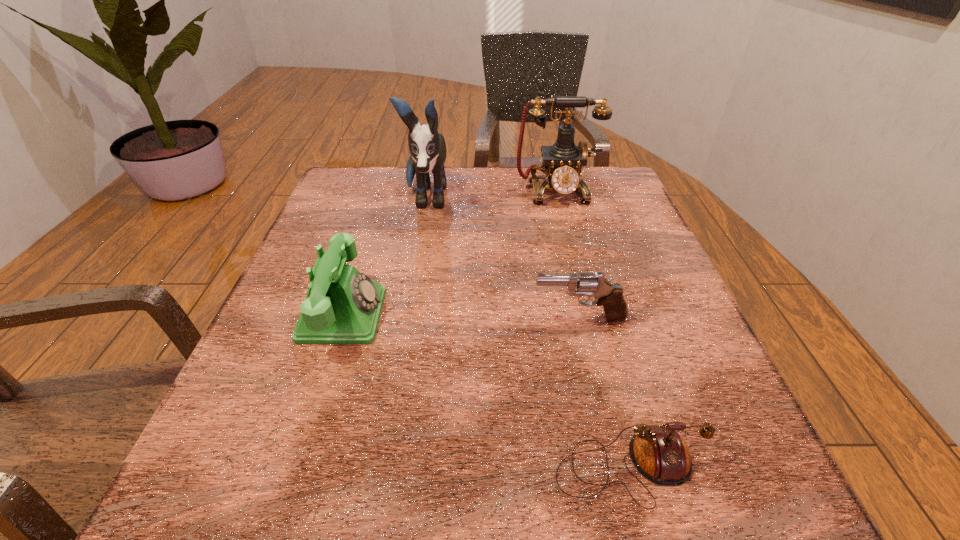
Locate which telephone ranks in proximity to the farthest telephone. Please provide its 2D coordinates. Your answer should be formatted as a tuple, i.e. [(x, y)], where the tuple contains the x and y coordinates of a point satisfying the conditions above.

[(343, 306)]

The width and height of the screenshot is (960, 540). In order to click on free space that satisfies the following two spatial constraints: 1. on the front of the tallest telephone, featuring the rotary dial; 2. at the barrel of the pistol in this screenshot , I will do `click(588, 319)`.

The height and width of the screenshot is (540, 960). Find the location of `free space that satisfies the following two spatial constraints: 1. on the front of the tallest telephone, featuring the rotary dial; 2. at the barrel of the pistol`. free space that satisfies the following two spatial constraints: 1. on the front of the tallest telephone, featuring the rotary dial; 2. at the barrel of the pistol is located at coordinates (588, 319).

You are a GUI agent. You are given a task and a screenshot of the screen. Output one action in this format:
    pyautogui.click(x=<x>, y=<y>)
    Task: Click on the vacant space that satisfies the following two spatial constraints: 1. on the front of the farthest telephone, featuring the rotary dial; 2. on the dial of the leftmost telephone
    
    Given the screenshot: What is the action you would take?
    pyautogui.click(x=588, y=315)

This screenshot has height=540, width=960. Find the location of `vacant region that satisfies the following two spatial constraints: 1. on the front of the tallest telephone, featuring the rotary dial; 2. at the barrel of the fourth tallest object`. vacant region that satisfies the following two spatial constraints: 1. on the front of the tallest telephone, featuring the rotary dial; 2. at the barrel of the fourth tallest object is located at coordinates (588, 319).